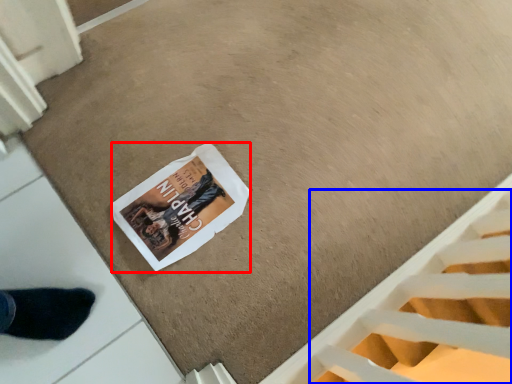
Question: Which object appears farthest to the camera in this image, magazine (highlighted by a red box) or stairwell (highlighted by a blue box)?

Choices:
 (A) magazine
 (B) stairwell

Answer: (A)